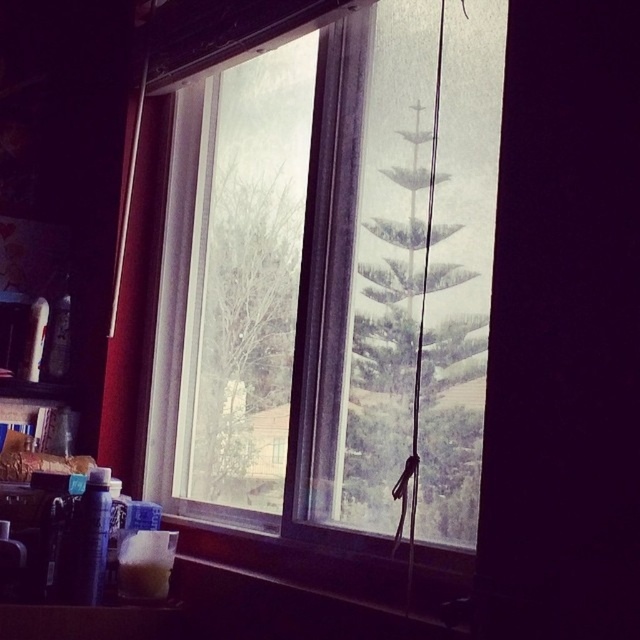
Which is below, green matte tree at center or bare branches at center?

bare branches at center

Does green matte tree at center appear on the left side of bare branches at center?

In fact, green matte tree at center is to the right of bare branches at center.

In order to click on green matte tree at center in this screenshot , I will do `click(385, 323)`.

Which of these two, transparent glass window at center or green matte tree at center, stands taller?

transparent glass window at center is taller.

Which is above, transparent glass window at center or green matte tree at center?

Positioned higher is transparent glass window at center.

At what (x,y) coordinates should I click in order to perform the action: click on transparent glass window at center. Please return your answer as a coordinate pair (x, y). Looking at the image, I should click on (301, 282).

Does transparent glass window at center have a lesser height compared to bare branches at center?

No.

Who is more forward, (304, 196) or (200, 433)?

Positioned in front is point (304, 196).

This screenshot has height=640, width=640. In order to click on transparent glass window at center in this screenshot , I will do `click(301, 282)`.